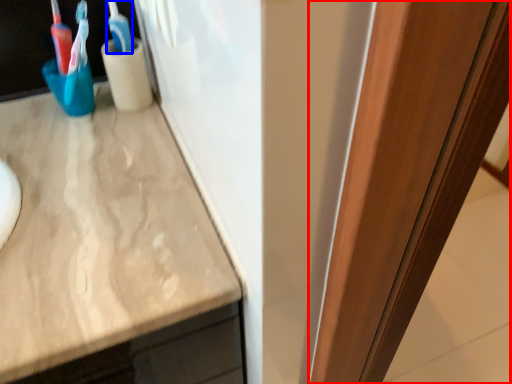
Question: Which object appears farthest to the camera in this image, glass door (highlighted by a red box) or toothbrush (highlighted by a blue box)?

Choices:
 (A) glass door
 (B) toothbrush

Answer: (B)